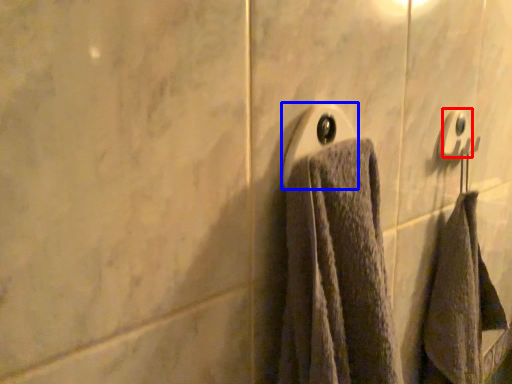
Question: Among these objects, which one is nearest to the camera, towel bar (highlighted by a red box) or towel bar (highlighted by a blue box)?

Choices:
 (A) towel bar
 (B) towel bar

Answer: (B)